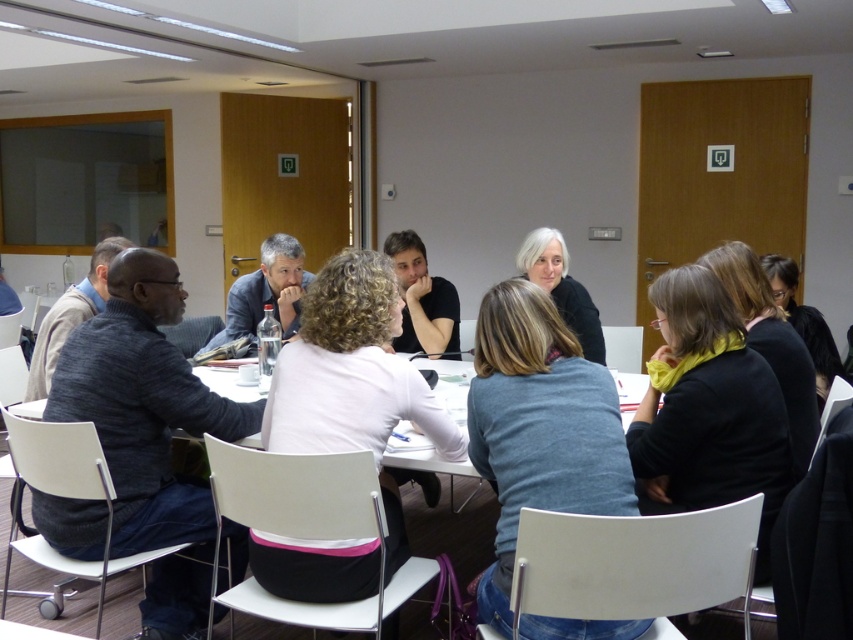
From the picture: Can you confirm if dark gray sweater at left is taller than light pink fabric shirt at center?

Yes.

The width and height of the screenshot is (853, 640). Identify the location of dark gray sweater at left. (144, 406).

Where is `dark gray sweater at left`? The height and width of the screenshot is (640, 853). dark gray sweater at left is located at coordinates (144, 406).